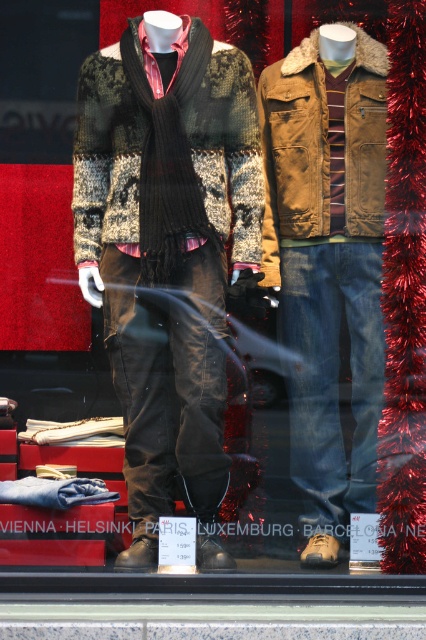
Based on the photo, can you confirm if denim jeans at center is taller than black ribbed scarf at center?

Yes.

Between point (370, 500) and point (157, 193), which one is positioned behind?

The point (370, 500) is behind.

I want to click on denim jeans at center, so click(328, 260).

Locate an element on the screen. The image size is (426, 640). denim jeans at center is located at coordinates (328, 260).

Is point (328, 509) more distant than point (255, 161)?

Yes, point (328, 509) is behind point (255, 161).

How distant is denim jeans at center from knitted patchwork sweater at center?

A distance of 16.59 inches exists between denim jeans at center and knitted patchwork sweater at center.

Between point (334, 32) and point (230, 104), which one is positioned in front?

Point (230, 104) is more forward.

I want to click on denim jeans at center, so click(x=328, y=260).

Can you confirm if knitted patchwork sweater at center is positioned above black ribbed scarf at center?

Correct, knitted patchwork sweater at center is located above black ribbed scarf at center.

Who is taller, knitted patchwork sweater at center or black ribbed scarf at center?

With more height is black ribbed scarf at center.

This screenshot has height=640, width=426. What do you see at coordinates (106, 156) in the screenshot? I see `knitted patchwork sweater at center` at bounding box center [106, 156].

Find the location of a particular element. knitted patchwork sweater at center is located at coordinates [106, 156].